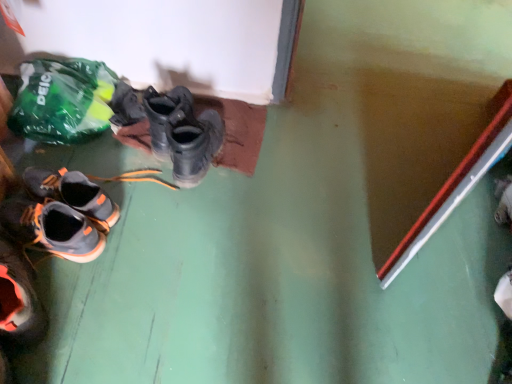
What do you see at coordinates (173, 129) in the screenshot? The width and height of the screenshot is (512, 384). I see `matte black boots at center` at bounding box center [173, 129].

This screenshot has height=384, width=512. What do you see at coordinates (63, 100) in the screenshot?
I see `green plastic bag at upper left` at bounding box center [63, 100].

In order to click on gray suede shoes at lower left in this screenshot , I will do `click(52, 229)`.

Identify the location of matte black boots at center. This screenshot has width=512, height=384. pyautogui.click(x=173, y=129).

Is matte black boots at center aimed at gray suede shoes at lower left?

No, matte black boots at center is not aimed at gray suede shoes at lower left.

From the image's perspective, is matte black boots at center on top of gray suede shoes at lower left?

Yes.

Is matte black boots at center spatially inside gray suede shoes at lower left, or outside of it?

matte black boots at center is located beyond the bounds of gray suede shoes at lower left.

Is matte black boots at center shorter than gray suede shoes at lower left?

Yes.

This screenshot has width=512, height=384. Identify the location of plastic bag on the left of gray suede shoes at lower left. pyautogui.click(x=63, y=100).

Which is in front, green plastic bag at upper left or gray suede shoes at lower left?

gray suede shoes at lower left.

Between green plastic bag at upper left and gray suede shoes at lower left, which one has less height?

gray suede shoes at lower left is shorter.

From the image's perspective, is green plastic bag at upper left above gray suede shoes at lower left?

Indeed, from the image's perspective, green plastic bag at upper left is shown above gray suede shoes at lower left.

Based on the photo, considering the positions of objects matte black boots at center and green plastic bag at upper left in the image provided, who is more to the right, matte black boots at center or green plastic bag at upper left?

matte black boots at center.

Could you tell me if matte black boots at center is facing green plastic bag at upper left?

A: No, matte black boots at center is not facing towards green plastic bag at upper left.

Consider the image. Between matte black boots at center and green plastic bag at upper left, which one has less height?

Standing shorter between the two is matte black boots at center.

From a real-world perspective, is gray suede shoes at lower left physically located above or below green plastic bag at upper left?

In terms of real-world spatial position, gray suede shoes at lower left is below green plastic bag at upper left.

In the scene shown: Considering the sizes of gray suede shoes at lower left and green plastic bag at upper left in the image, is gray suede shoes at lower left taller or shorter than green plastic bag at upper left?

gray suede shoes at lower left is shorter than green plastic bag at upper left.

Does gray suede shoes at lower left appear on the right side of green plastic bag at upper left?

Correct, you'll find gray suede shoes at lower left to the right of green plastic bag at upper left.

In the scene shown: Relative to green plastic bag at upper left, is gray suede shoes at lower left in front or behind?

In the image, gray suede shoes at lower left appears in front of green plastic bag at upper left.

Which object is more forward, gray suede shoes at lower left or matte black boots at center?

Positioned in front is gray suede shoes at lower left.

Is gray suede shoes at lower left positioned far away from matte black boots at center?

No, gray suede shoes at lower left is in close proximity to matte black boots at center.

This screenshot has height=384, width=512. I want to click on footwear that is on the right side of gray suede shoes at lower left, so click(173, 129).

How many degrees apart are the facing directions of gray suede shoes at lower left and matte black boots at center?

The angular difference between gray suede shoes at lower left and matte black boots at center is 105 degrees.

Does point (25, 90) come behind point (160, 136)?

Yes.

Between green plastic bag at upper left and matte black boots at center, which one has larger size?

Bigger between the two is green plastic bag at upper left.

Is green plastic bag at upper left taller than matte black boots at center?

Correct, green plastic bag at upper left is much taller as matte black boots at center.

From the image's perspective, which one is positioned lower, green plastic bag at upper left or matte black boots at center?

From the image's view, matte black boots at center is below.

Image resolution: width=512 pixels, height=384 pixels. Find the location of `footwear that appears on the right of gray suede shoes at lower left`. footwear that appears on the right of gray suede shoes at lower left is located at coordinates (173, 129).

Find the location of a particular element. The height and width of the screenshot is (384, 512). shoe in front of the green plastic bag at upper left is located at coordinates 52,229.

Looking at the image, which one is located closer to matte black boots at center, green plastic bag at upper left or gray suede shoes at lower left?

Based on the image, green plastic bag at upper left appears to be nearer to matte black boots at center.

Looking at the image, which one is located closer to green plastic bag at upper left, gray suede shoes at lower left or matte black boots at center?

Based on the image, matte black boots at center appears to be nearer to green plastic bag at upper left.

Considering their positions, is matte black boots at center positioned closer to gray suede shoes at lower left than green plastic bag at upper left?

Among the two, green plastic bag at upper left is located nearer to gray suede shoes at lower left.

Based on the photo, from the image, which object appears to be farther from green plastic bag at upper left, matte black boots at center or gray suede shoes at lower left?

gray suede shoes at lower left is further to green plastic bag at upper left.

When comparing their distances from matte black boots at center, does gray suede shoes at lower left or green plastic bag at upper left seem closer?

green plastic bag at upper left is closer to matte black boots at center.

Considering their positions, is green plastic bag at upper left positioned closer to gray suede shoes at lower left than matte black boots at center?

green plastic bag at upper left is closer to gray suede shoes at lower left.

Where is `shoe between green plastic bag at upper left and matte black boots at center in the horizontal direction`? The height and width of the screenshot is (384, 512). shoe between green plastic bag at upper left and matte black boots at center in the horizontal direction is located at coordinates (52, 229).